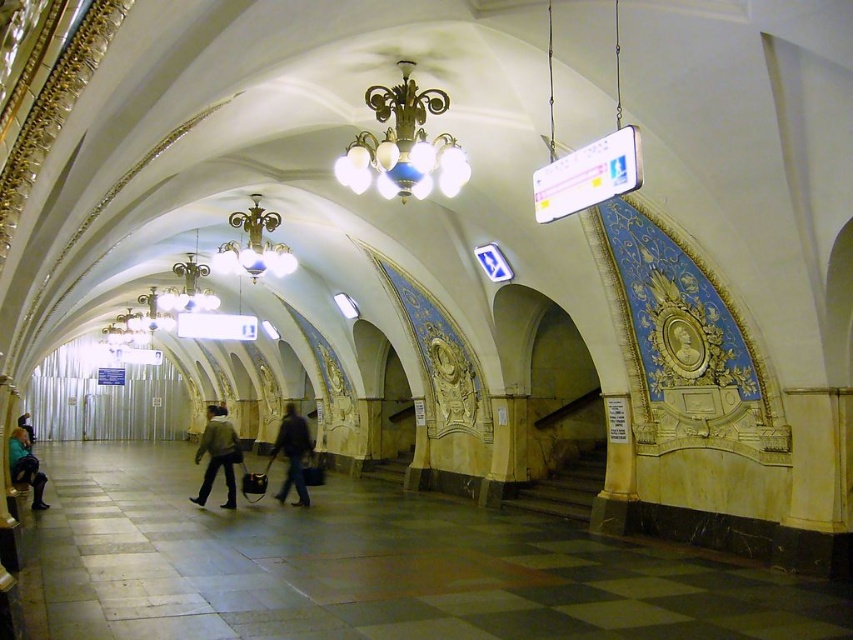
Can you confirm if gold metallic chandelier at center is thinner than dark blue jeans at center?

Correct, gold metallic chandelier at center's width is less than dark blue jeans at center's.

Is point (277, 216) positioned in front of point (277, 433)?

Yes, it is.

Who is more distant from viewer, (231, 218) or (299, 499)?

Positioned behind is point (299, 499).

You are a GUI agent. You are given a task and a screenshot of the screen. Output one action in this format:
    pyautogui.click(x=<x>, y=<y>)
    Task: Click on the gold metallic chandelier at center
    
    Given the screenshot: What is the action you would take?
    pyautogui.click(x=254, y=244)

Between metallic gold chandelier at center and gold metallic chandelier at center, which one appears on the right side from the viewer's perspective?

From the viewer's perspective, metallic gold chandelier at center appears more on the right side.

This screenshot has height=640, width=853. In order to click on metallic gold chandelier at center in this screenshot , I will do `click(403, 145)`.

Is gold metallic chandelier at center to the right of matte black jacket at lower left from the viewer's perspective?

Indeed, gold metallic chandelier at center is positioned on the right side of matte black jacket at lower left.

Which is more to the right, gold metallic chandelier at center or matte black jacket at lower left?

gold metallic chandelier at center

The height and width of the screenshot is (640, 853). I want to click on gold metallic chandelier at center, so click(254, 244).

I want to click on gold metallic chandelier at center, so click(x=254, y=244).